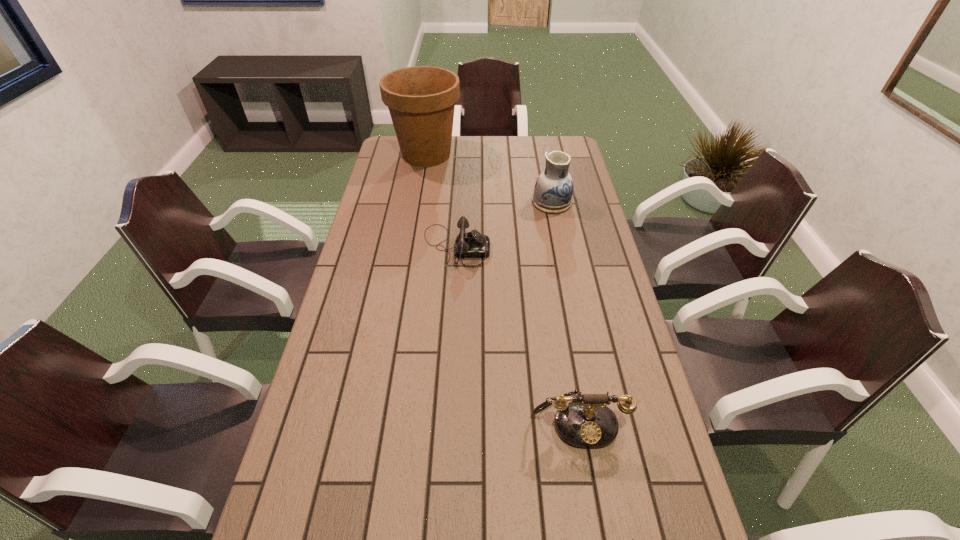
The width and height of the screenshot is (960, 540). What are the coordinates of `free space at the far left corner` in the screenshot? It's located at (399, 162).

I want to click on blank space at the far right corner, so pyautogui.click(x=562, y=137).

Where is `free spot between the right telephone and the left telephone`? The height and width of the screenshot is (540, 960). free spot between the right telephone and the left telephone is located at coordinates (517, 333).

The width and height of the screenshot is (960, 540). Identify the location of free spot between the left telephone and the flowerpot. (442, 201).

Identify which object is the fourth nearest to the sunglasses. Please provide its 2D coordinates. Your answer should be formatted as a tuple, i.e. [(x, y)], where the tuple contains the x and y coordinates of a point satisfying the conditions above.

[(421, 100)]

Identify which object is the nearest to the second nearest object. Please provide its 2D coordinates. Your answer should be formatted as a tuple, i.e. [(x, y)], where the tuple contains the x and y coordinates of a point satisfying the conditions above.

[(632, 539)]